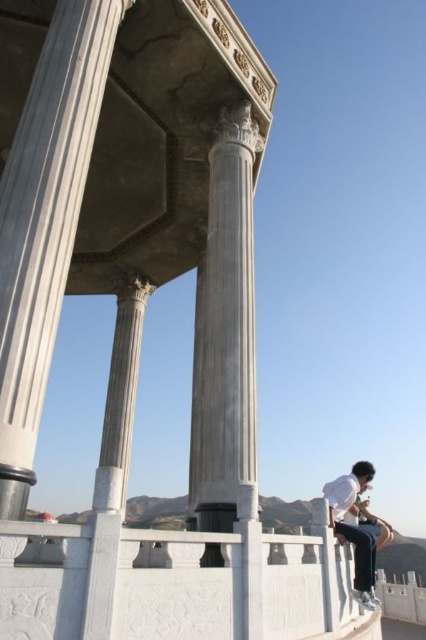
Based on the photo, you are standing at the point with coordinates point (45,220) in the image. What architectural feature are you facing?

The point (45,220) corresponds to the white marble pillar at center, so you are facing the white marble pillar at center.